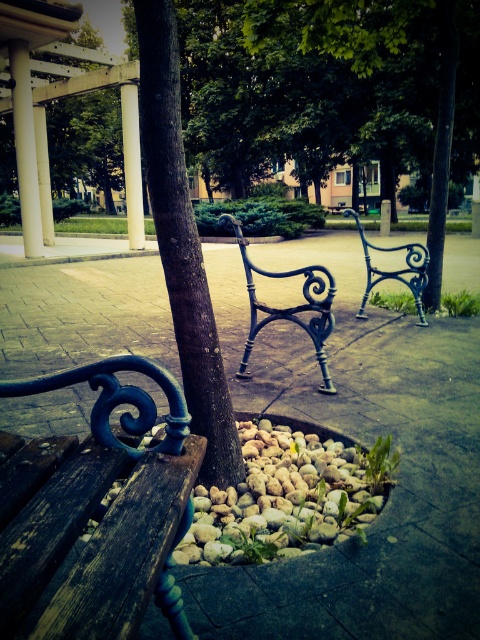
Question: Is black wrought iron bench at center smaller than white smooth column at center?

Choices:
 (A) no
 (B) yes

Answer: (B)

Question: Can you confirm if wooden bench at lower left is positioned to the left of blue wrought iron bench at center?

Choices:
 (A) yes
 (B) no

Answer: (A)

Question: Can you confirm if smooth concrete pavement at center is wider than smooth white column at upper left?

Choices:
 (A) yes
 (B) no

Answer: (A)

Question: Estimate the real-world distances between objects in this image. Which object is farther from the wooden bench at lower left?

Choices:
 (A) smooth concrete pavement at center
 (B) smooth white column at upper left
 (C) brown rough tree trunk at center
 (D) smooth concrete pillar at center

Answer: (D)

Question: Which object is the farthest from the white smooth column at center?

Choices:
 (A) brown rough tree trunk at center
 (B) wooden bench at lower left

Answer: (B)

Question: Which of these objects is positioned farthest from the wooden bench at lower left?

Choices:
 (A) smooth white column at upper left
 (B) white smooth column at center

Answer: (B)